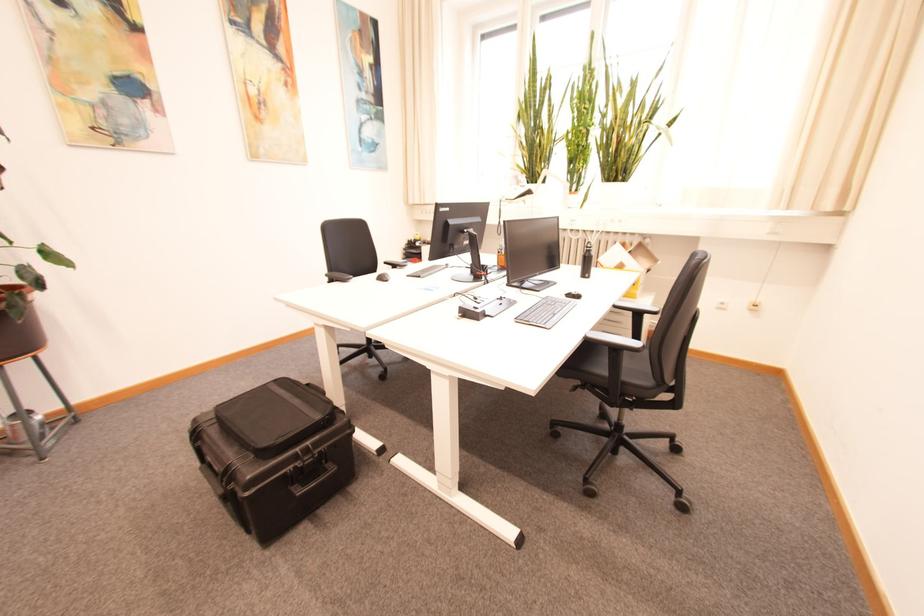
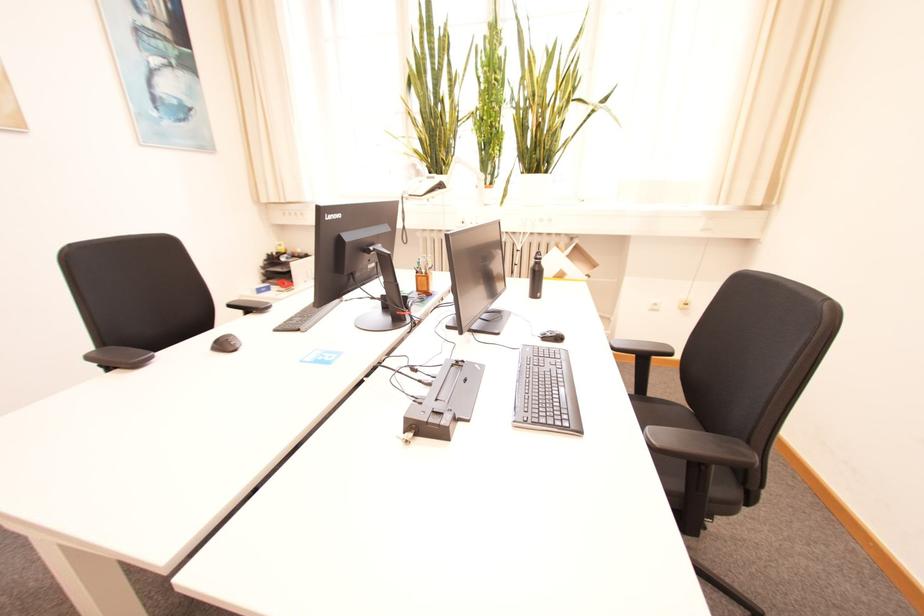
The point at (576, 297) is marked in the first image. Where is the corresponding point in the second image?

(551, 338)